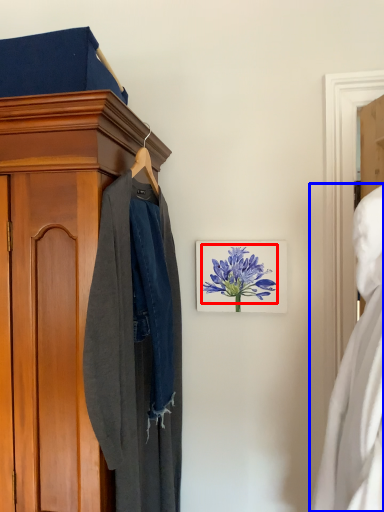
Question: Which of the following is the farthest to the observer, flower (highlighted by a red box) or dress (highlighted by a blue box)?

Choices:
 (A) flower
 (B) dress

Answer: (A)